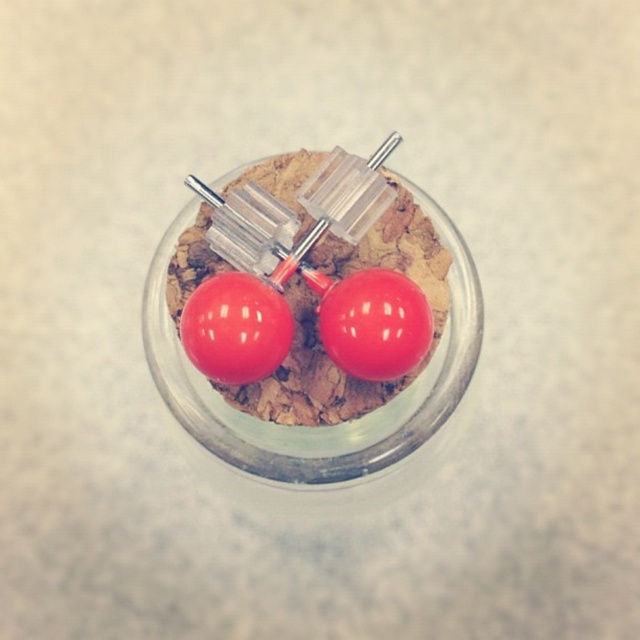
Question: Can you confirm if glossy plastic earrings at center is positioned to the right of glossy red cherry at center?

Choices:
 (A) yes
 (B) no

Answer: (A)

Question: Is glossy plastic earrings at center to the left of glossy red cherry at center from the viewer's perspective?

Choices:
 (A) yes
 (B) no

Answer: (B)

Question: Among these objects, which one is farthest from the camera?

Choices:
 (A) glossy plastic cherry at center
 (B) glossy plastic earrings at center

Answer: (B)

Question: Which point is farther to the camera?

Choices:
 (A) (262, 288)
 (B) (404, 365)
 (C) (321, 241)

Answer: (C)

Question: Does glossy plastic earrings at center have a larger size compared to glossy red cherry at center?

Choices:
 (A) yes
 (B) no

Answer: (A)

Question: Which of the following is the closest to the observer?

Choices:
 (A) (196, 248)
 (B) (237, 344)

Answer: (B)